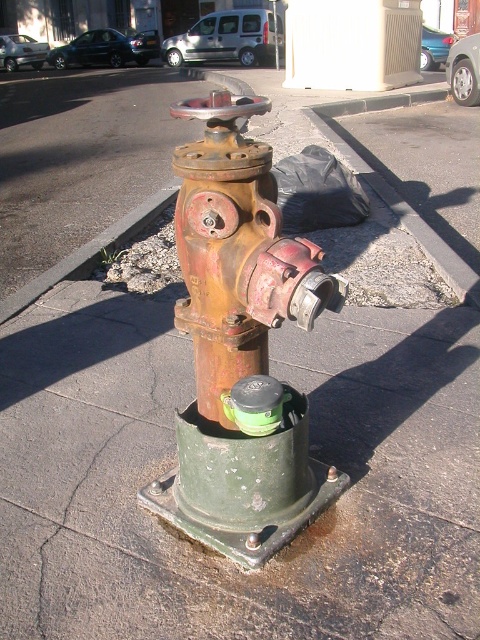
Question: Is rusty metal hydrant at center below rusty metal curb at lower left?

Choices:
 (A) no
 (B) yes

Answer: (B)

Question: Which point appears closest to the camera in this image?

Choices:
 (A) click(253, 99)
 (B) click(108, 248)

Answer: (B)

Question: Can you confirm if rusty metal hydrant at center is positioned to the right of rusty metal curb at lower left?

Choices:
 (A) no
 (B) yes

Answer: (B)

Question: Which object is closer to the camera taking this photo?

Choices:
 (A) rusty metal hydrant at center
 (B) rusty metal curb at lower left

Answer: (A)

Question: Can you confirm if rusty metal hydrant at center is wider than rusty metal curb at lower left?

Choices:
 (A) yes
 (B) no

Answer: (B)